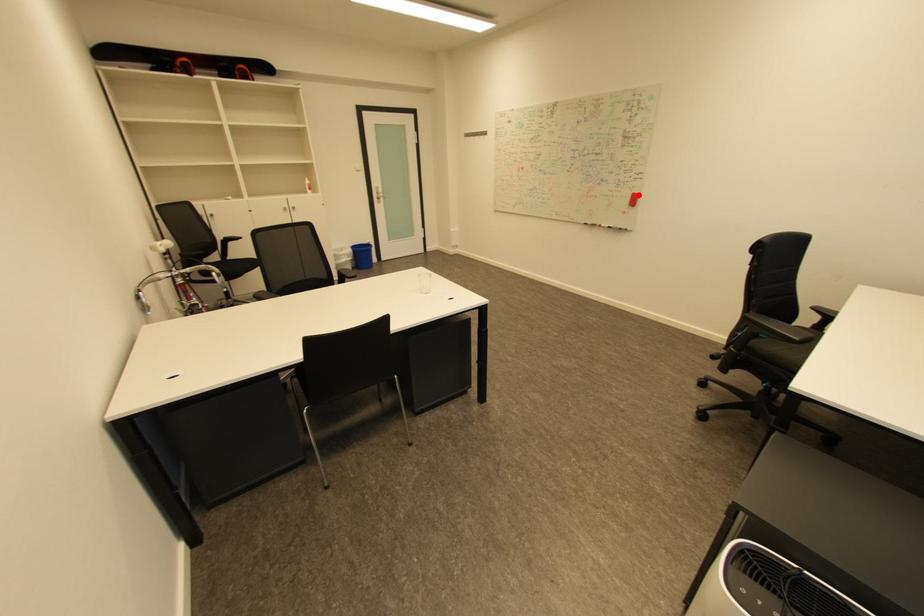
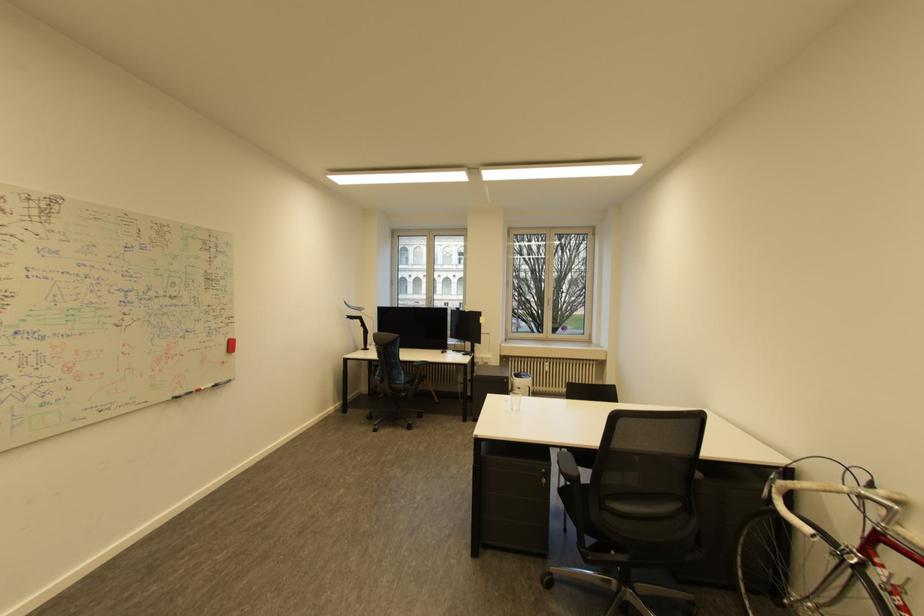
The point at the highlighted location is marked in the first image. Where is the corresponding point in the second image?

(234, 342)